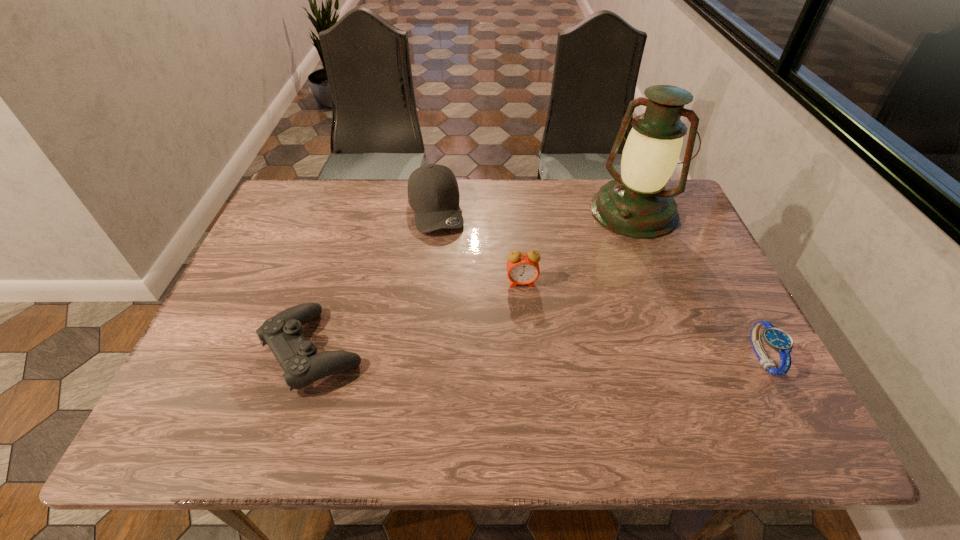
The image size is (960, 540). What are the coordinates of `control` in the screenshot? It's located at (297, 356).

I want to click on watch, so click(x=777, y=339).

Find the location of a particular element. the fourth object from right to left is located at coordinates (433, 193).

The image size is (960, 540). Identify the location of the third object from right to left. (522, 268).

The width and height of the screenshot is (960, 540). What are the coordinates of `the third farthest object` in the screenshot? It's located at (522, 268).

Where is `lantern`? The height and width of the screenshot is (540, 960). lantern is located at coordinates (635, 204).

What are the coordinates of `free spot located on the back of the control` in the screenshot? It's located at (348, 244).

Locate an element on the screen. This screenshot has width=960, height=540. free location located 0.210m on the back of the watch is located at coordinates (716, 271).

You are a GUI agent. You are given a task and a screenshot of the screen. Output one action in this format:
    pyautogui.click(x=<x>, y=<y>)
    Task: Click on the vacant space located on the front brim of the fourth object from right to left
    
    Given the screenshot: What is the action you would take?
    pyautogui.click(x=445, y=256)

At what (x,y) coordinates should I click in order to perform the action: click on free space located 0.330m on the front brim of the fourth object from right to left. Please return your answer as a coordinate pair (x, y). This screenshot has width=960, height=540. Looking at the image, I should click on (467, 327).